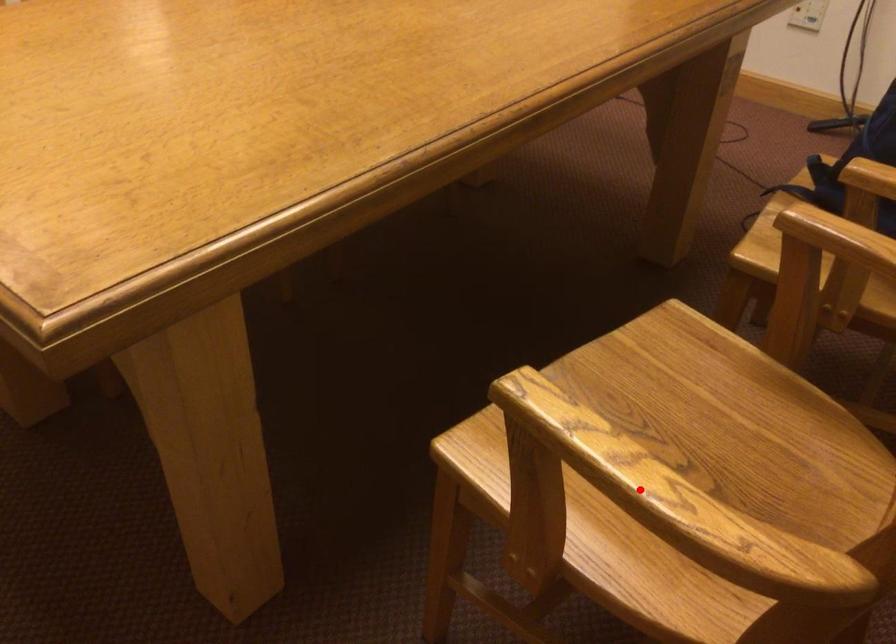
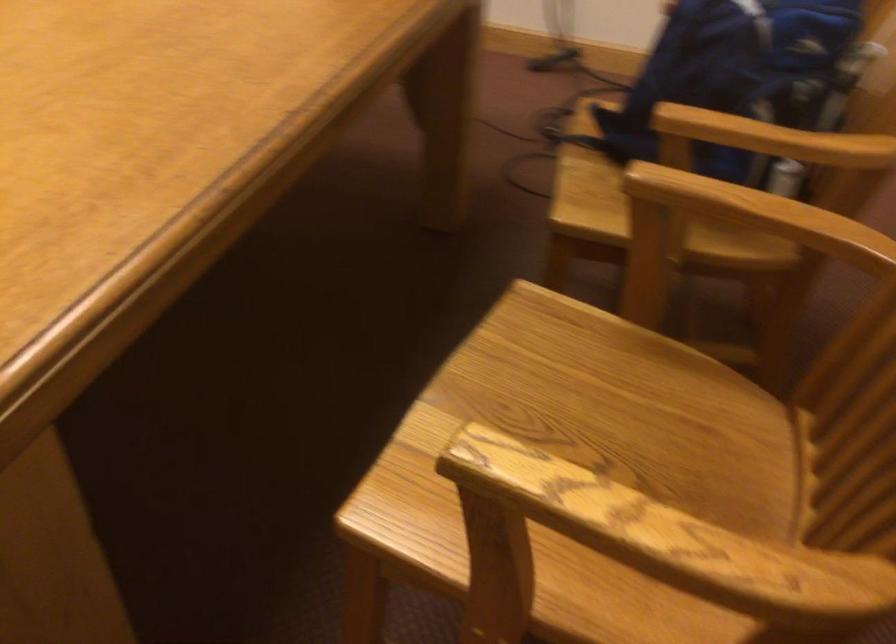
Question: I am providing you with two images of the same scene from different viewpoints. Image1 has a red point marked. In image2, the corresponding 3D location appears at what relative position? Reply with the corresponding letter.

Choices:
 (A) Closer
 (B) Farther

Answer: (A)